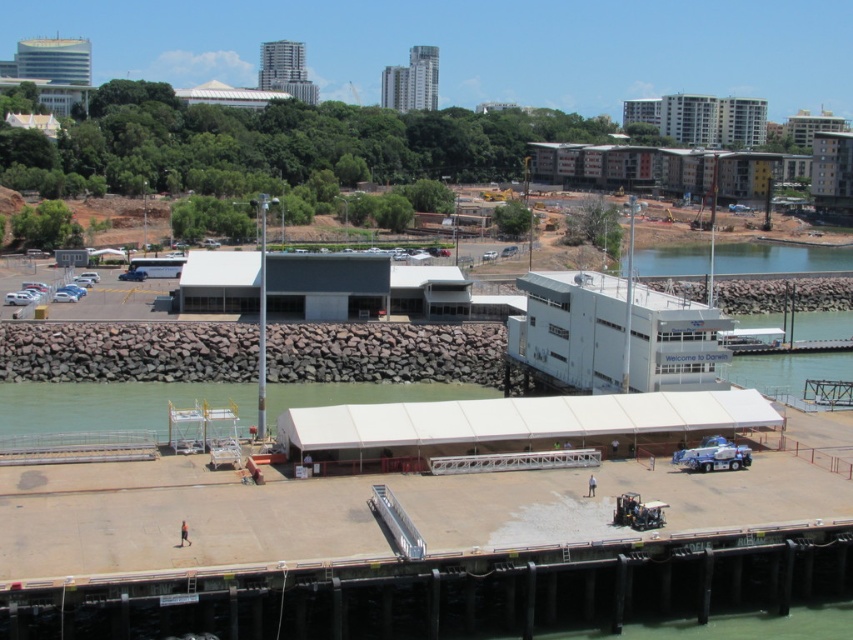
You are a boat captain planning to dock your vessel near the Darwin International Cruise Terminal. You need to choose between two areas of clear water at lower left and clear water at lower right. Based on their positions relative to each other, which area is closer to the terminal entrance?

The clear water at lower left is in front of clear water at lower right, meaning it is closer to the terminal entrance.

You are a boat operator who needs to navigate between the clear water at lower left and the clear water at lower right. Which direction should you steer to move from the left to the right side?

You should steer to the right to move from the clear water at lower left to the clear water at lower right since the clear water at lower left is positioned on the left side of the clear water at lower right.

You are a delivery boat captain trying to navigate between the two clear water areas in the image. The boat requires a minimum of 300 feet of space to safely pass through. Based on the scene, can you determine if there is enough space between the clear water at lower left and clear water at lower right to safely navigate your boat through?

The clear water at lower left and clear water at lower right are 320.98 feet apart from each other. Since the boat requires a minimum of 300 feet of space to safely pass through, the distance is sufficient, so yes, there is enough space to safely navigate between them.